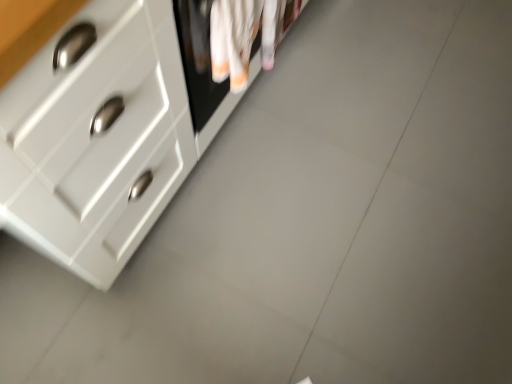
Locate an element on the screen. The image size is (512, 384). white glossy chest of drawers at upper left is located at coordinates (100, 139).

The height and width of the screenshot is (384, 512). What do you see at coordinates (100, 139) in the screenshot?
I see `white glossy chest of drawers at upper left` at bounding box center [100, 139].

The height and width of the screenshot is (384, 512). What do you see at coordinates (245, 36) in the screenshot?
I see `white cotton laundry at upper center` at bounding box center [245, 36].

At what (x,y) coordinates should I click in order to perform the action: click on white cotton laundry at upper center. Please return your answer as a coordinate pair (x, y). This screenshot has width=512, height=384. Looking at the image, I should click on (245, 36).

Consider the image. What is the approximate width of white cotton laundry at upper center?

white cotton laundry at upper center is 3.43 inches in width.

The height and width of the screenshot is (384, 512). I want to click on white glossy chest of drawers at upper left, so click(100, 139).

Between white glossy chest of drawers at upper left and white cotton laundry at upper center, which one appears on the left side from the viewer's perspective?

From the viewer's perspective, white glossy chest of drawers at upper left appears more on the left side.

Between white glossy chest of drawers at upper left and white cotton laundry at upper center, which one is positioned in front?

white glossy chest of drawers at upper left.

Is point (26, 209) positioned in front of point (245, 85)?

Yes.

From the image's perspective, is white glossy chest of drawers at upper left located beneath white cotton laundry at upper center?

No.

From a real-world perspective, does white glossy chest of drawers at upper left sit lower than white cotton laundry at upper center?

Correct, in the physical world, white glossy chest of drawers at upper left is lower than white cotton laundry at upper center.

Which of these two, white glossy chest of drawers at upper left or white cotton laundry at upper center, is thinner?

white cotton laundry at upper center.

Is white glossy chest of drawers at upper left shorter than white cotton laundry at upper center?

In fact, white glossy chest of drawers at upper left may be taller than white cotton laundry at upper center.

Does white glossy chest of drawers at upper left have a smaller size compared to white cotton laundry at upper center?

No.

Would you say white cotton laundry at upper center is part of white glossy chest of drawers at upper left's contents?

That's incorrect, white cotton laundry at upper center is not inside white glossy chest of drawers at upper left.

Is white glossy chest of drawers at upper left not close to white cotton laundry at upper center?

That's not correct — white glossy chest of drawers at upper left is a little close to white cotton laundry at upper center.

Is white glossy chest of drawers at upper left looking in the opposite direction of white cotton laundry at upper center?

Yes, white glossy chest of drawers at upper left is facing away from white cotton laundry at upper center.

How different are the orientations of white glossy chest of drawers at upper left and white cotton laundry at upper center in degrees?

The angle between the facing direction of white glossy chest of drawers at upper left and the facing direction of white cotton laundry at upper center is 0.163 degrees.

How distant is white glossy chest of drawers at upper left from white cotton laundry at upper center?

A distance of 28.05 centimeters exists between white glossy chest of drawers at upper left and white cotton laundry at upper center.

In order to click on laundry behind the white glossy chest of drawers at upper left in this screenshot , I will do `click(245, 36)`.

Visually, is white cotton laundry at upper center positioned to the left or to the right of white glossy chest of drawers at upper left?

white cotton laundry at upper center is to the right of white glossy chest of drawers at upper left.

Considering their positions, is white cotton laundry at upper center located in front of or behind white glossy chest of drawers at upper left?

white cotton laundry at upper center is positioned farther from the viewer than white glossy chest of drawers at upper left.

Looking at this image, which point is more forward, (246, 47) or (22, 170)?

Point (22, 170)

From the image's perspective, is white cotton laundry at upper center above or below white glossy chest of drawers at upper left?

white cotton laundry at upper center is situated lower than white glossy chest of drawers at upper left in the image.

From a real-world perspective, which object stands above the other?

white cotton laundry at upper center, from a real-world perspective.

Which of these two, white cotton laundry at upper center or white glossy chest of drawers at upper left, is thinner?

Thinner between the two is white cotton laundry at upper center.

Which of these two, white cotton laundry at upper center or white glossy chest of drawers at upper left, stands taller?

Standing taller between the two is white glossy chest of drawers at upper left.

Does white cotton laundry at upper center have a smaller size compared to white glossy chest of drawers at upper left?

Yes.

Is white cotton laundry at upper center inside or outside of white glossy chest of drawers at upper left?

white cotton laundry at upper center is spatially situated outside white glossy chest of drawers at upper left.

Is white cotton laundry at upper center beside white glossy chest of drawers at upper left?

white cotton laundry at upper center and white glossy chest of drawers at upper left are clearly separated.

Is white cotton laundry at upper center looking in the opposite direction of white glossy chest of drawers at upper left?

Yes, white cotton laundry at upper center's orientation is away from white glossy chest of drawers at upper left.

How different are the orientations of white cotton laundry at upper center and white glossy chest of drawers at upper left in degrees?

The angle between the facing direction of white cotton laundry at upper center and the facing direction of white glossy chest of drawers at upper left is 0.163 degrees.

The height and width of the screenshot is (384, 512). What are the coordinates of `laundry above the white glossy chest of drawers at upper left (from a real-world perspective)` in the screenshot? It's located at (245, 36).

Find the location of a particular element. This screenshot has width=512, height=384. the chest of drawers that is in front of the white cotton laundry at upper center is located at coordinates (100, 139).

Find the location of `chest of drawers on the left of white cotton laundry at upper center`. chest of drawers on the left of white cotton laundry at upper center is located at coordinates (100, 139).